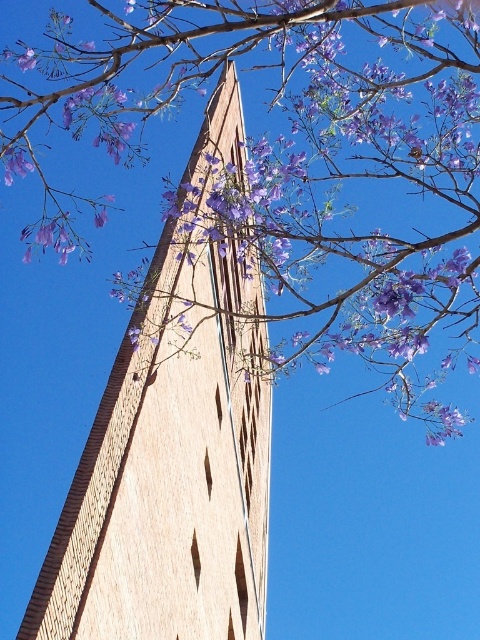
Question: In this image, where is purple leafy branches at upper center located relative to light brown brick tower at center?

Choices:
 (A) left
 (B) right

Answer: (B)

Question: Is purple leafy branches at upper center further to the viewer compared to light brown brick tower at center?

Choices:
 (A) yes
 (B) no

Answer: (A)

Question: Which object is closer to the camera taking this photo?

Choices:
 (A) purple leafy branches at upper center
 (B) light brown brick tower at center

Answer: (B)

Question: Can you confirm if purple leafy branches at upper center is positioned above light brown brick tower at center?

Choices:
 (A) no
 (B) yes

Answer: (B)